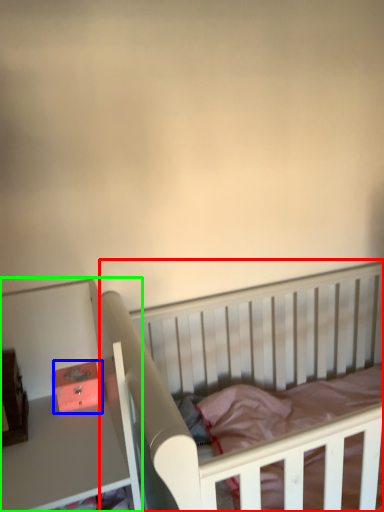
Question: Which object is positioned farthest from infant bed (highlighted by a red box)? Select from box (highlighted by a blue box) and table (highlighted by a green box).

Choices:
 (A) box
 (B) table

Answer: (A)